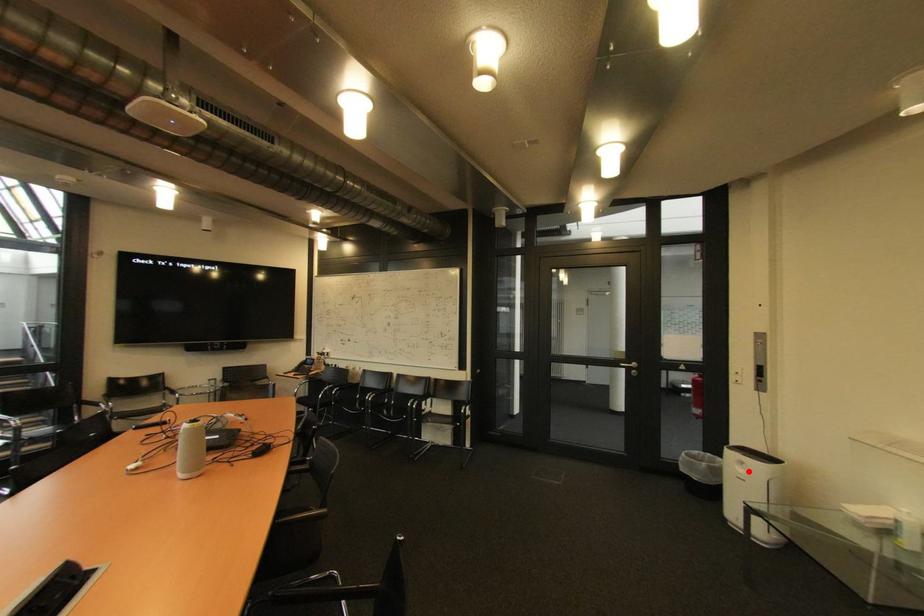
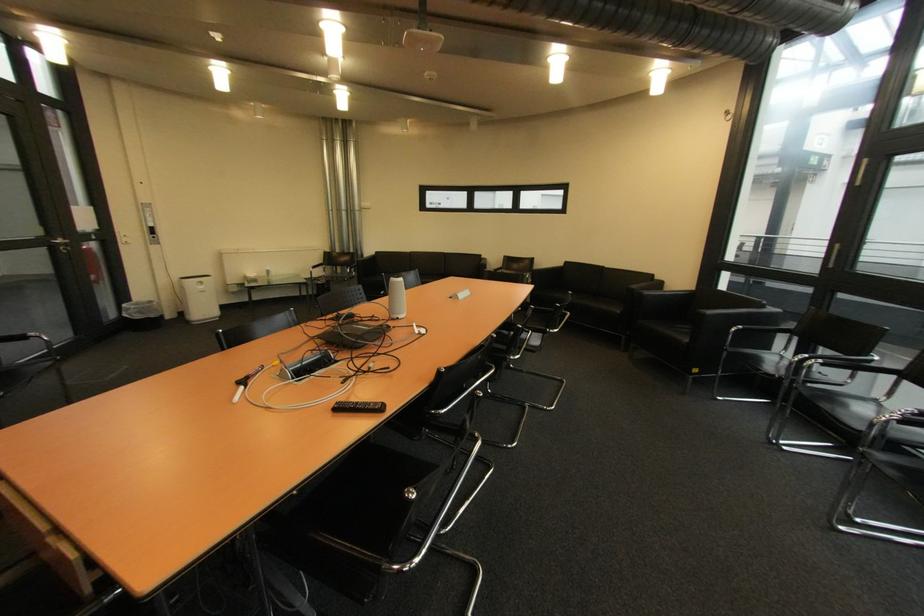
Find the pixel in the second image that matches the highlighted location in the first image.

(209, 288)